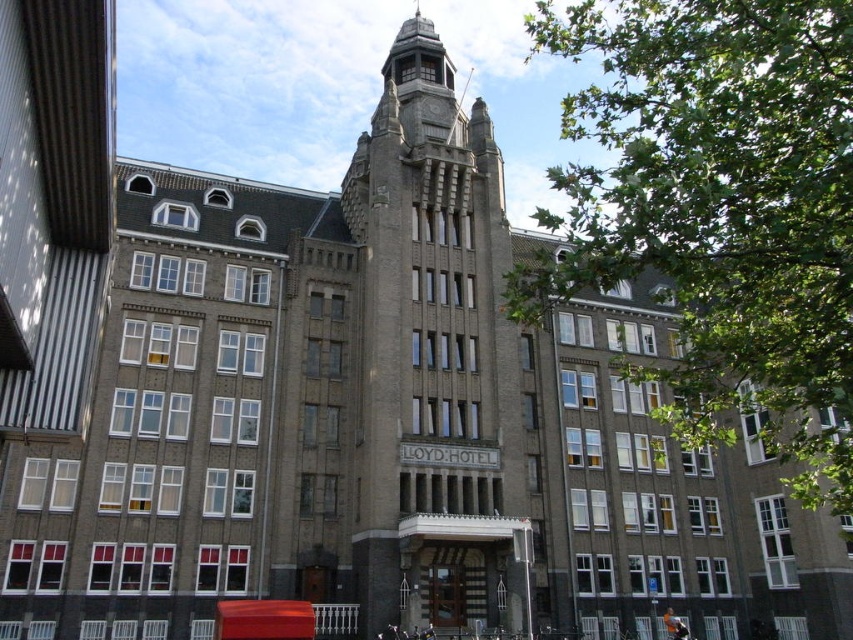
Question: Is green leafy tree at upper right wider than brown stone tower at center?

Choices:
 (A) yes
 (B) no

Answer: (A)

Question: Which of the following is the farthest from the observer?

Choices:
 (A) (726, 99)
 (B) (473, 173)

Answer: (B)

Question: Is green leafy tree at upper right below brown stone tower at center?

Choices:
 (A) yes
 (B) no

Answer: (B)

Question: Can you confirm if green leafy tree at upper right is positioned to the left of brown stone tower at center?

Choices:
 (A) yes
 (B) no

Answer: (B)

Question: Which object appears farthest from the camera in this image?

Choices:
 (A) brown stone tower at center
 (B) green leafy tree at upper right

Answer: (A)